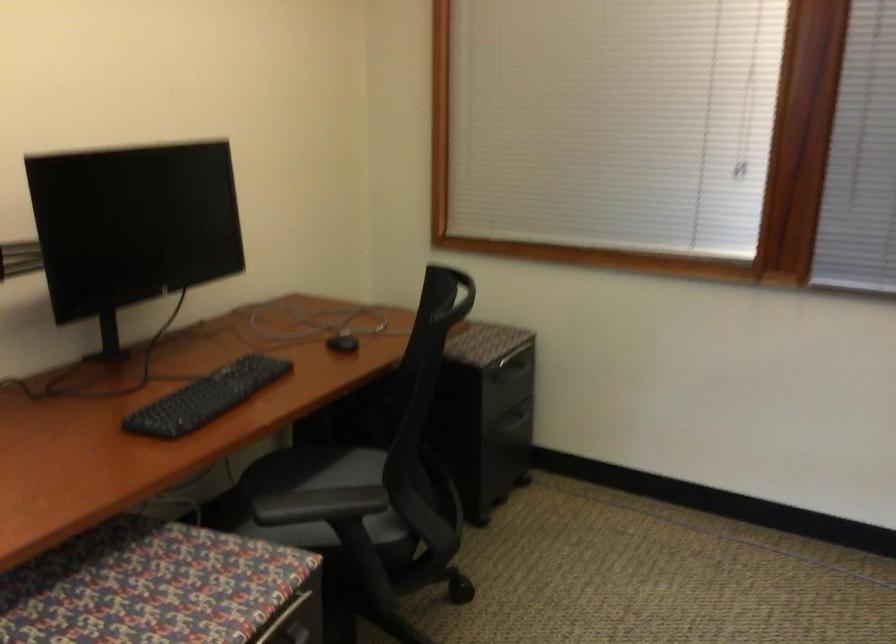
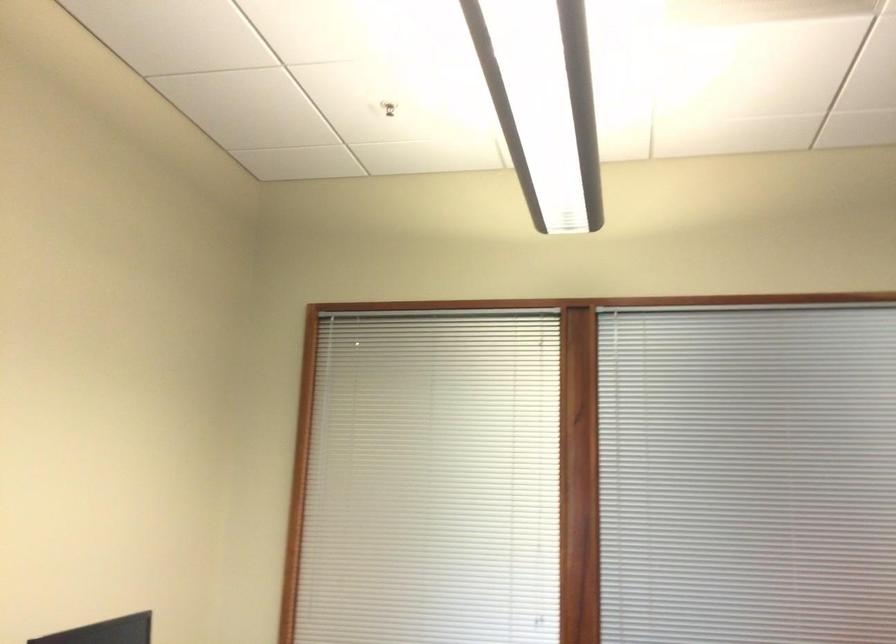
From the picture: The images are taken continuously from a first-person perspective. In which direction is your viewpoint rotating?

The camera's rotation is toward right-up.